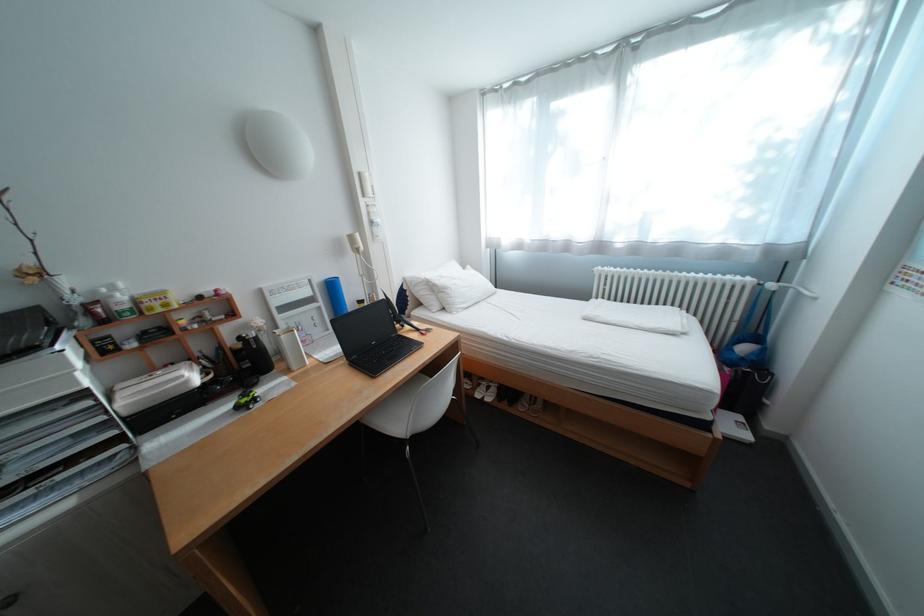
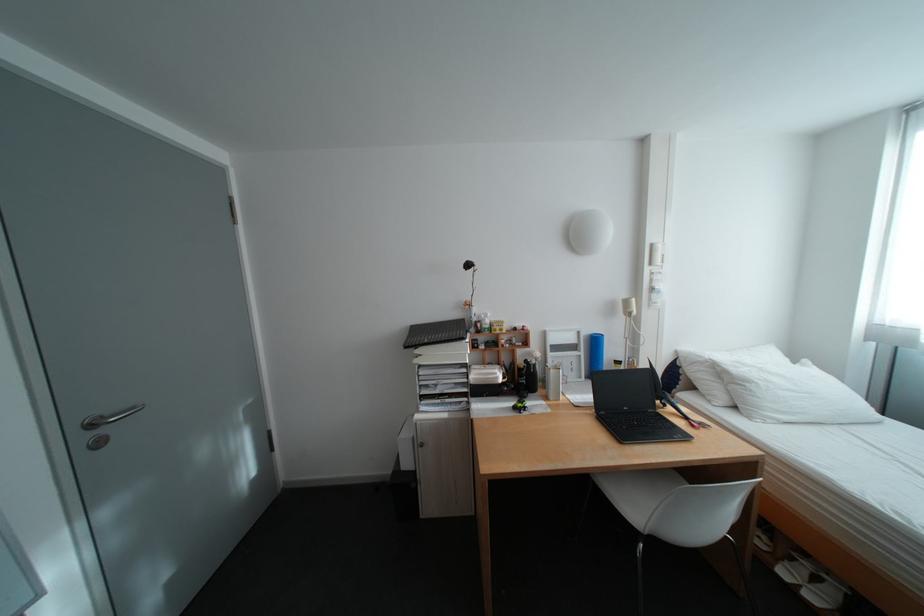
In the second image, find the point that corresponds to (224,377) in the first image.

(518, 381)